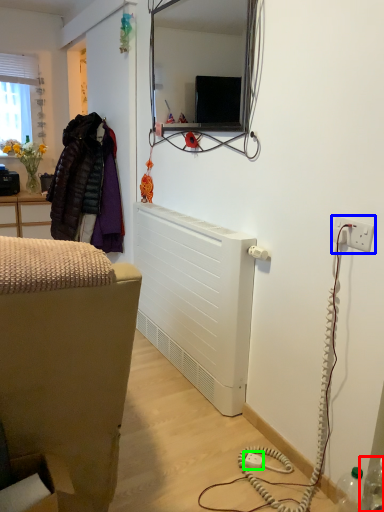
Question: Which object is positioned farthest from bottle (highlighted by a red box)? Select from electric outlet (highlighted by a blue box) and plug (highlighted by a green box).

Choices:
 (A) electric outlet
 (B) plug

Answer: (A)